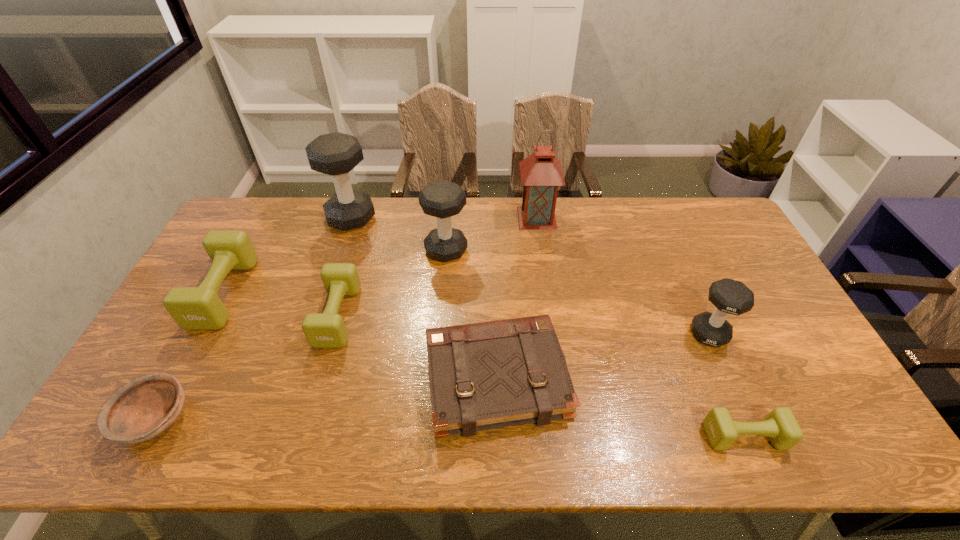
This screenshot has width=960, height=540. I want to click on vacant space that's between the fifth shortest object and the brown bowl, so pos(189,356).

Where is `unoccupied position between the bowl and the fifth tallest dumbbell`? unoccupied position between the bowl and the fifth tallest dumbbell is located at coordinates [247, 367].

Image resolution: width=960 pixels, height=540 pixels. Identify the location of vacant space that is in between the second shortest dumbbell and the second gray dumbbell from left to right. (392, 283).

Find the location of a particular element. The height and width of the screenshot is (540, 960). object that is the fourth closest to the pink lantern is located at coordinates (336, 154).

Identify the location of object that is the closest one to the third shortest dumbbell. Image resolution: width=960 pixels, height=540 pixels. (142, 409).

Identify which dumbbell is the fourth closest to the second gray dumbbell from right to left. Please provide its 2D coordinates. Your answer should be formatted as a tuple, i.e. [(x, y)], where the tuple contains the x and y coordinates of a point satisfying the conditions above.

[(729, 296)]

Identify the location of the closest dumbbell to the third tallest dumbbell. The image size is (960, 540). (780, 425).

Where is `the third closest gray dumbbell to the bowl`? This screenshot has height=540, width=960. the third closest gray dumbbell to the bowl is located at coordinates (729, 296).

Choose which gray dumbbell is the third nearest neighbor to the pink lantern. Please provide its 2D coordinates. Your answer should be formatted as a tuple, i.e. [(x, y)], where the tuple contains the x and y coordinates of a point satisfying the conditions above.

[(336, 154)]

Identify which olive dumbbell is located as the third nearest to the brown bowl. Please provide its 2D coordinates. Your answer should be formatted as a tuple, i.e. [(x, y)], where the tuple contains the x and y coordinates of a point satisfying the conditions above.

[(780, 425)]